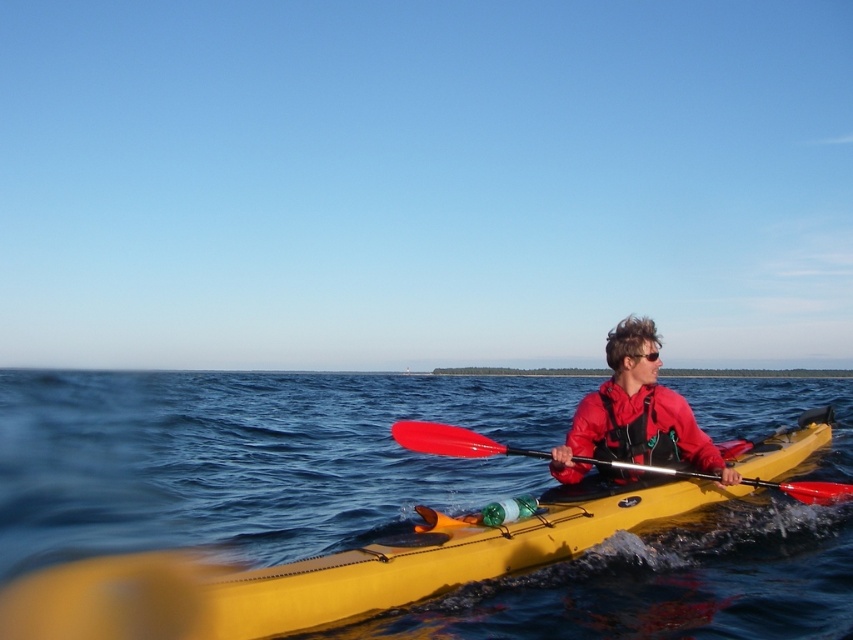
Question: Which of the following is the closest to the observer?

Choices:
 (A) (469, 429)
 (B) (71, 372)
 (C) (642, 356)

Answer: (C)

Question: Among these objects, which one is farthest from the camera?

Choices:
 (A) red matte jacket at center
 (B) blue water at center
 (C) red plastic paddle at center

Answer: (A)

Question: Can you confirm if blue water at center is positioned to the right of red matte jacket at center?

Choices:
 (A) no
 (B) yes

Answer: (B)

Question: Does blue water at center lie in front of red plastic paddle at center?

Choices:
 (A) no
 (B) yes

Answer: (B)

Question: From the image, what is the correct spatial relationship of red matte jacket at center in relation to red plastic paddle at center?

Choices:
 (A) above
 (B) below

Answer: (A)

Question: Which point is closer to the camera taking this photo?

Choices:
 (A) (38, 392)
 (B) (408, 419)
 (C) (624, 419)

Answer: (C)